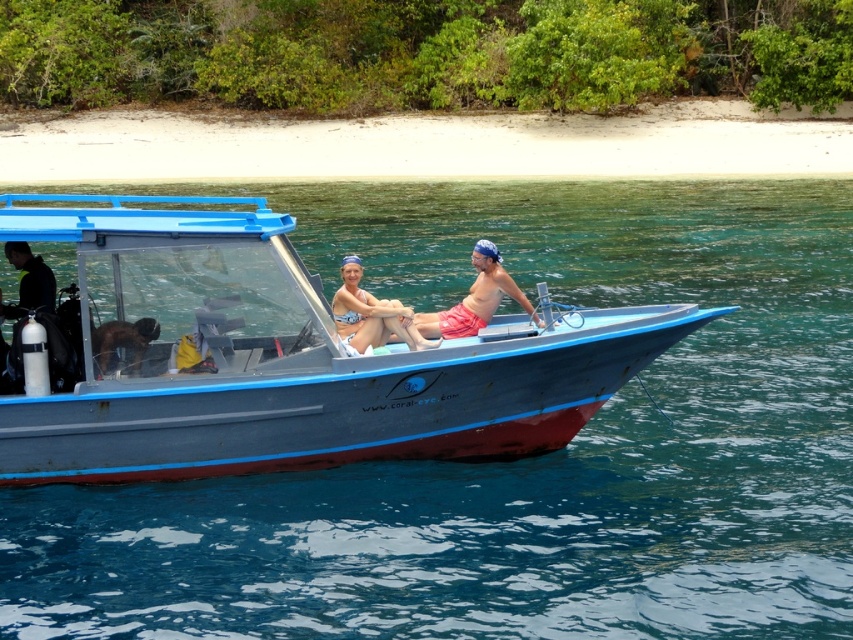
You are planning to place a new seat on the blue metallic boat at center. The seat requires a space wider than the matte orange shorts at center. Can the boat accommodate the seat?

The blue metallic boat at center is wider than the matte orange shorts at center, so the boat can accommodate the seat since its width is sufficient.

You are a photographer trying to capture the blue metallic boat at center and the matte pink bikini at center in the same frame. Since the boat is larger, will you need to adjust your camera angle to include both?

The blue metallic boat at center is larger in size than the matte pink bikini at center, so you will need to adjust your camera angle to ensure both fit in the frame.